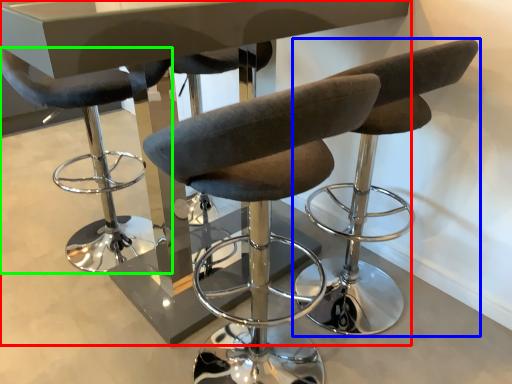
Question: Estimate the real-world distances between objects in this image. Which object is closer to table (highlighted by a red box), chair (highlighted by a blue box) or chair (highlighted by a green box)?

Choices:
 (A) chair
 (B) chair

Answer: (A)